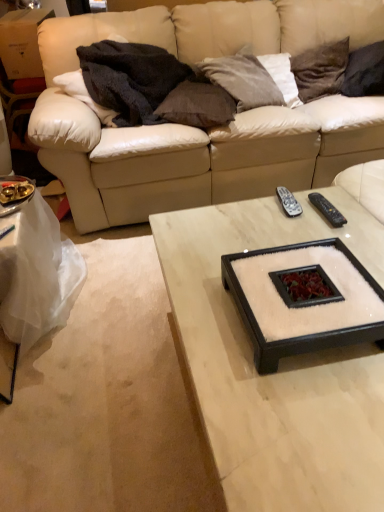
I want to click on vacant area that is in front of white felt square tray at center, so click(x=305, y=422).